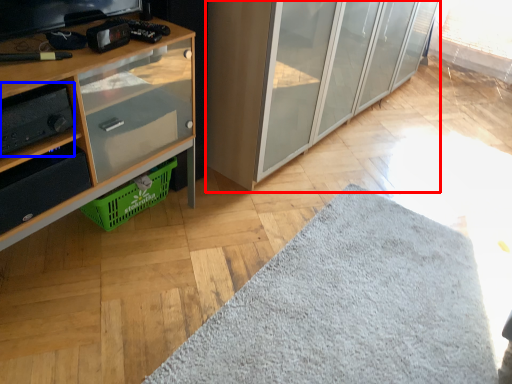
Question: Which point is closer to the camera, cabinetry (highlighted by a red box) or stereo (highlighted by a blue box)?

Choices:
 (A) cabinetry
 (B) stereo

Answer: (B)